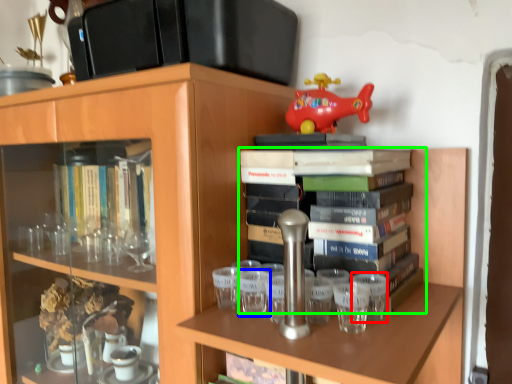
Question: Which object is the closest to the shot glass (highlighted by a red box)? Choose among these: shot glass (highlighted by a blue box) or book (highlighted by a green box).

Choices:
 (A) shot glass
 (B) book

Answer: (B)